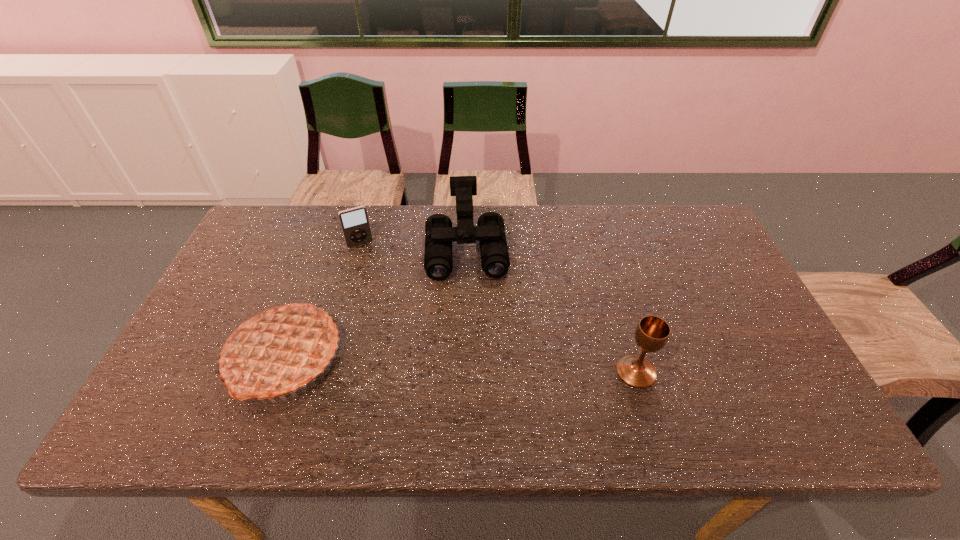
This screenshot has height=540, width=960. In order to click on vacant space on the desktop that is between the pie and the chalice and is positioned on the front-facing side of the shortest object in this screenshot , I will do `click(413, 362)`.

Image resolution: width=960 pixels, height=540 pixels. What are the coordinates of `vacant spot on the desktop that is between the pie and the chalice and is positioned on the front lenses of the binoculars` in the screenshot? It's located at (472, 365).